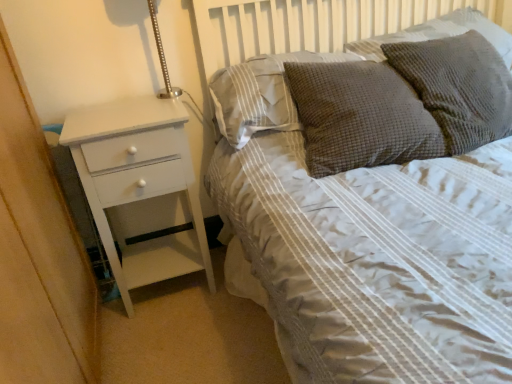
Image resolution: width=512 pixels, height=384 pixels. Identify the location of free space in front of white painted wood chest of drawers at left. (174, 341).